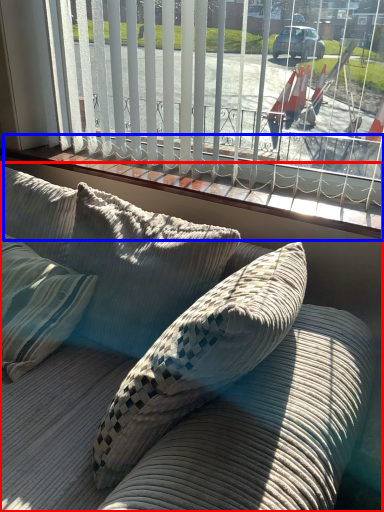
Question: Which of the following is the farthest to the observer, studio couch (highlighted by a red box) or window sill (highlighted by a blue box)?

Choices:
 (A) studio couch
 (B) window sill

Answer: (B)